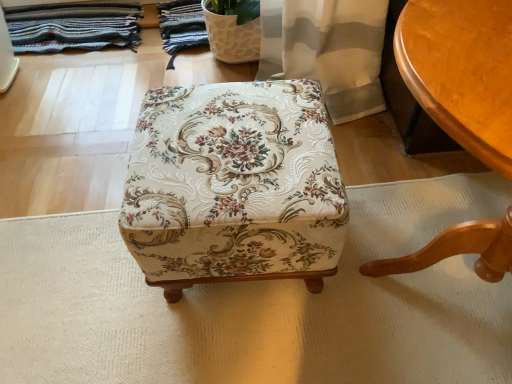
Question: From the image's perspective, is floral fabric ottoman at center on top of striped woolen blanket at upper left?

Choices:
 (A) no
 (B) yes

Answer: (A)

Question: Is floral fabric ottoman at center positioned far away from striped woolen blanket at upper left?

Choices:
 (A) yes
 (B) no

Answer: (A)

Question: Does floral fabric ottoman at center have a lesser height compared to striped woolen blanket at upper left?

Choices:
 (A) yes
 (B) no

Answer: (B)

Question: Can you confirm if floral fabric ottoman at center is smaller than striped woolen blanket at upper left?

Choices:
 (A) yes
 (B) no

Answer: (B)

Question: Is floral fabric ottoman at center to the left of striped woolen blanket at upper left from the viewer's perspective?

Choices:
 (A) yes
 (B) no

Answer: (B)

Question: Considering the relative sizes of floral fabric ottoman at center and striped woolen blanket at upper left in the image provided, is floral fabric ottoman at center wider than striped woolen blanket at upper left?

Choices:
 (A) yes
 (B) no

Answer: (A)

Question: Would you say striped woolen blanket at upper left is outside floral fabric ottoman at center?

Choices:
 (A) yes
 (B) no

Answer: (A)

Question: Is striped woolen blanket at upper left closer to camera compared to floral fabric ottoman at center?

Choices:
 (A) no
 (B) yes

Answer: (A)

Question: Can you confirm if striped woolen blanket at upper left is wider than floral fabric ottoman at center?

Choices:
 (A) no
 (B) yes

Answer: (A)

Question: Does striped woolen blanket at upper left have a lesser width compared to floral fabric ottoman at center?

Choices:
 (A) no
 (B) yes

Answer: (B)

Question: Does striped woolen blanket at upper left appear on the left side of floral fabric ottoman at center?

Choices:
 (A) no
 (B) yes

Answer: (B)

Question: Is striped woolen blanket at upper left oriented away from floral fabric ottoman at center?

Choices:
 (A) no
 (B) yes

Answer: (A)

Question: Is smooth wooden table at right not near floral fabric ottoman at center?

Choices:
 (A) no
 (B) yes

Answer: (A)